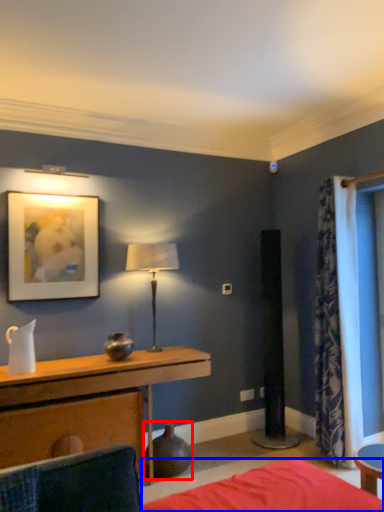
Question: Which of the following is the farthest to the observer, vase (highlighted by a red box) or bed frame (highlighted by a blue box)?

Choices:
 (A) vase
 (B) bed frame

Answer: (A)